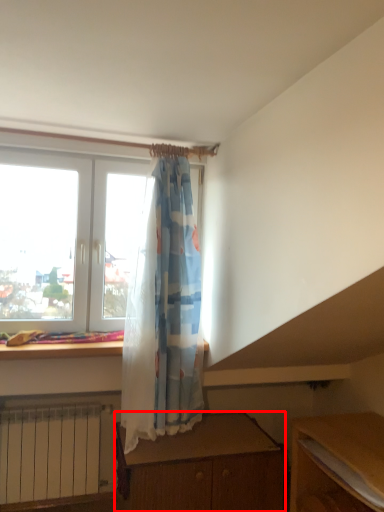
Question: From the image's perspective, what is the correct spatial positioning of desk (annotated by the red box) in reference to table?

Choices:
 (A) below
 (B) above

Answer: (A)